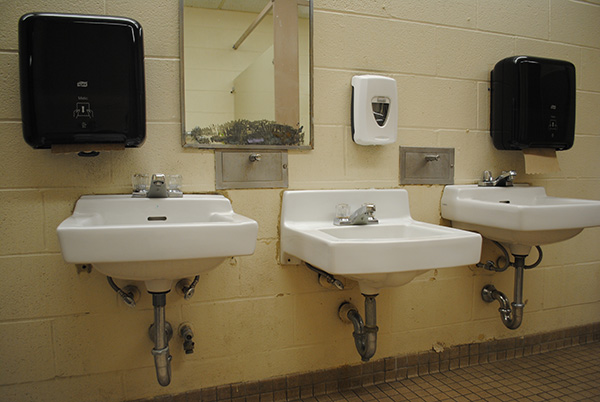
Identify the location of beige color on wall. The image size is (600, 402). (404, 44), (546, 18).